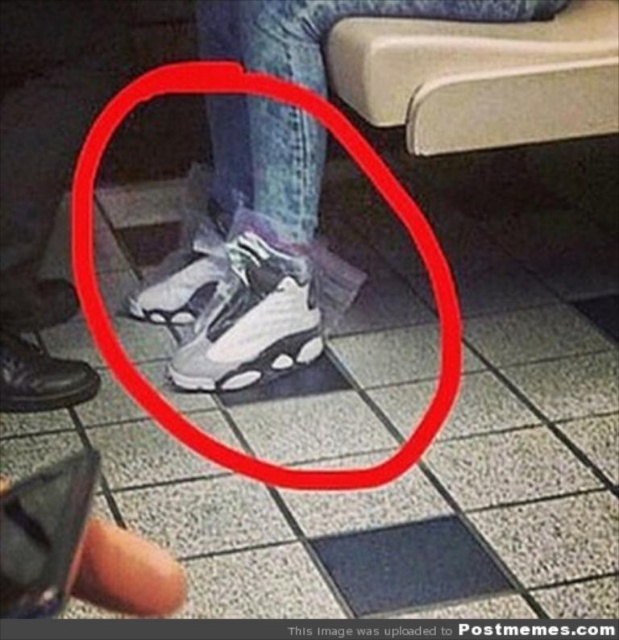
Is black matte smartphone at lower left thinner than black leather shoe at lower left?

Indeed, black matte smartphone at lower left has a lesser width compared to black leather shoe at lower left.

Is black matte smartphone at lower left below black leather shoe at lower left?

Yes, black matte smartphone at lower left is below black leather shoe at lower left.

Who is more distant from viewer, (x=58, y=576) or (x=46, y=387)?

The point (x=46, y=387) is behind.

Locate an element on the screen. The height and width of the screenshot is (640, 619). black matte smartphone at lower left is located at coordinates (45, 534).

Which is in front, point (2, 556) or point (24, 284)?

Positioned in front is point (2, 556).

Is black matte smartphone at lower left taller than matte white sneaker at center?

In fact, black matte smartphone at lower left may be shorter than matte white sneaker at center.

Is point (67, 577) closer to camera compared to point (53, 296)?

That is True.

Where is `black matte smartphone at lower left`? This screenshot has width=619, height=640. black matte smartphone at lower left is located at coordinates click(x=45, y=534).

Does point (204, 259) come closer to viewer compared to point (50, 308)?

No, (204, 259) is further to viewer.

Which is behind, point (217, 266) or point (66, 316)?

Positioned behind is point (66, 316).

Image resolution: width=619 pixels, height=640 pixels. I want to click on white matte sneaker at center, so click(x=183, y=276).

This screenshot has height=640, width=619. What are the coordinates of `white matte sneaker at center` in the screenshot? It's located at (183, 276).